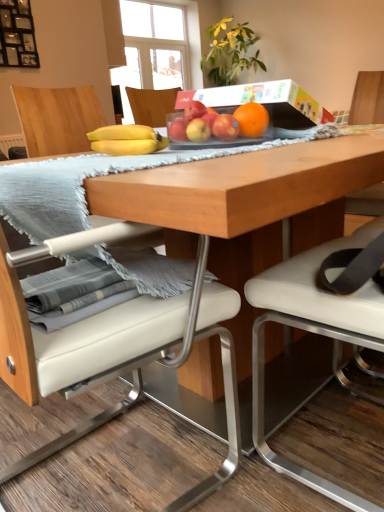
Locate an element on the screen. The width and height of the screenshot is (384, 512). vacant region to the left of red matte apple at center, the 4th apple from the left is located at coordinates (178, 141).